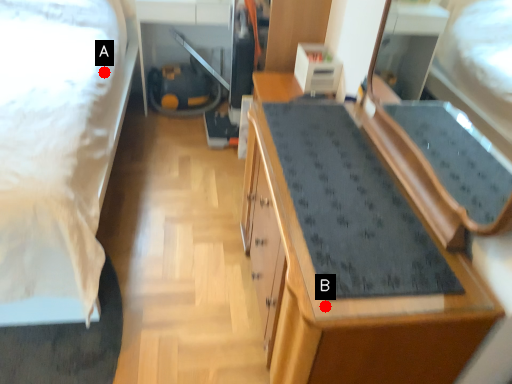
Question: Two points are circled on the image, labeled by A and B beside each circle. Which point appears closest to the camera in this image?

Choices:
 (A) A is closer
 (B) B is closer

Answer: (B)